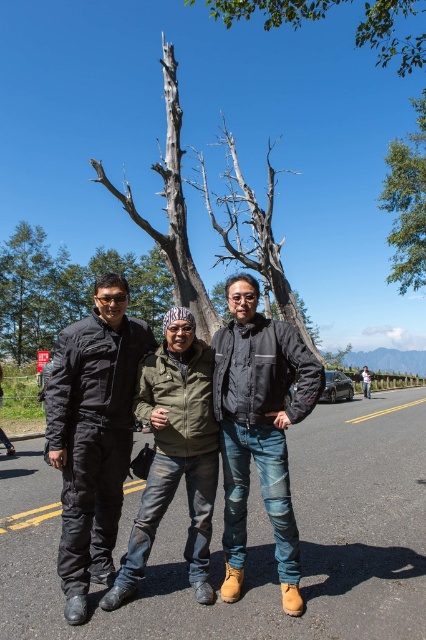
Based on the photo, can you confirm if charcoal textured trunk at center is wider than glossy black car at center?

Yes.

Can you confirm if charcoal textured trunk at center is taller than glossy black car at center?

Correct, charcoal textured trunk at center is much taller as glossy black car at center.

Is point (175, 243) behind point (325, 401)?

That is True.

Locate an element on the screen. charcoal textured trunk at center is located at coordinates [170, 209].

Based on the photo, which of these two, green matte jacket at center or green leafy tree at upper center, stands taller?

With more height is green leafy tree at upper center.

Between green matte jacket at center and green leafy tree at upper center, which one has less height?

green matte jacket at center

Where is `green matte jacket at center`? This screenshot has height=640, width=426. green matte jacket at center is located at coordinates (175, 454).

Which is in front, point (204, 408) or point (402, 209)?

Point (204, 408) is in front.

Measure the distance from green matte jacket at center to green leafy tree at upper right.

A distance of 37.31 meters exists between green matte jacket at center and green leafy tree at upper right.

You are a GUI agent. You are given a task and a screenshot of the screen. Output one action in this format:
    pyautogui.click(x=<x>, y=<y>)
    Task: Click on the green matte jacket at center
    This screenshot has height=640, width=426.
    Given the screenshot: What is the action you would take?
    pyautogui.click(x=175, y=454)